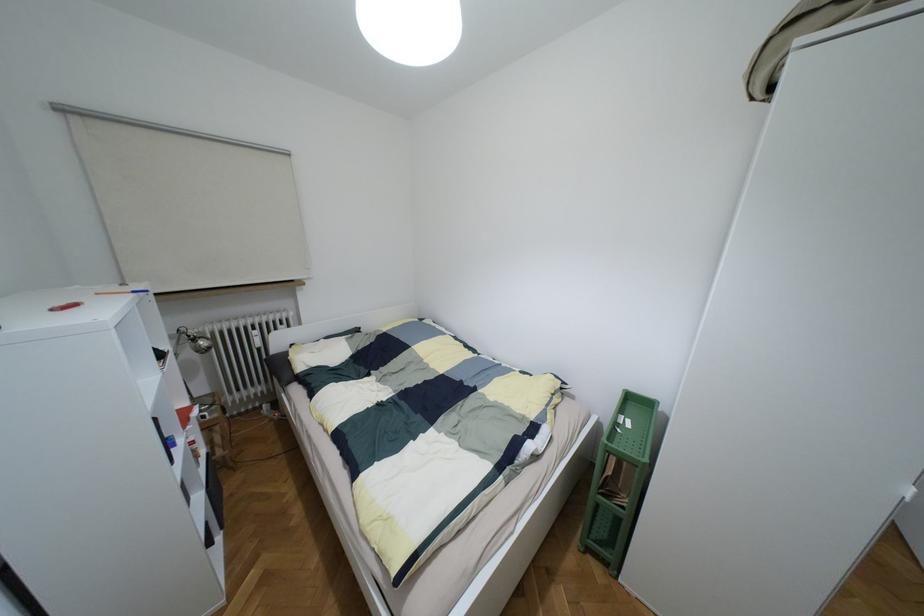
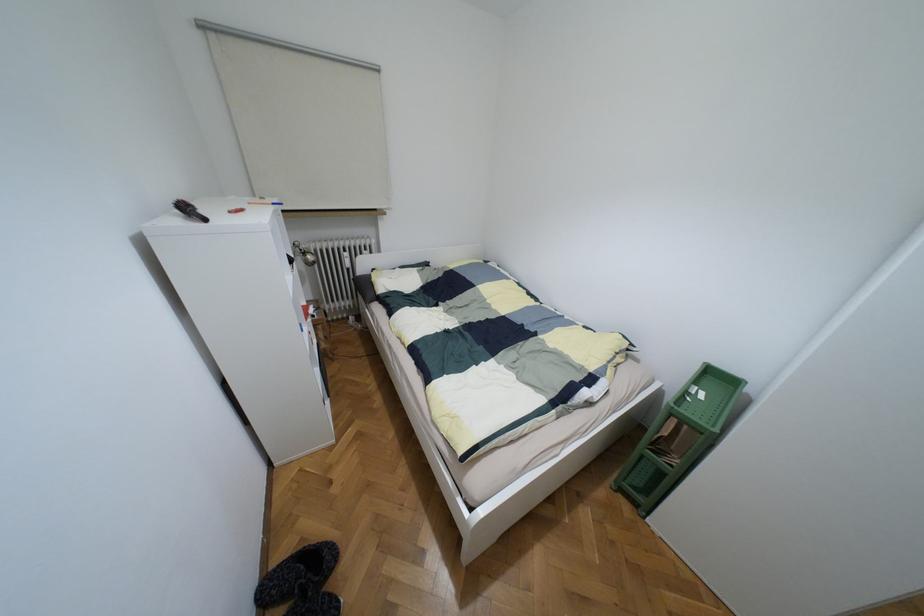
Question: How did the camera likely rotate?

Choices:
 (A) Left
 (B) Right
 (C) Up
 (D) Down

Answer: (D)